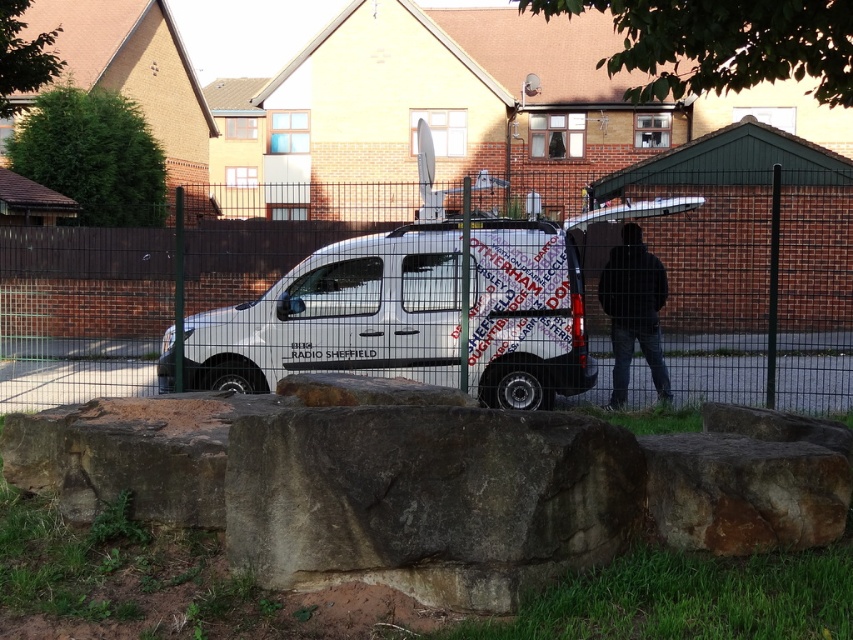
You are standing in the scene and see the brown rough stone at center and the black fabric jacket at center. Which object is closer to the ground?

The brown rough stone at center is closer to the ground because it is below the black fabric jacket at center.

You are standing in front of the white van and looking at the brown rough stone at center and the black fabric jacket at center. Which object is nearer to you?

The brown rough stone at center is closer to the viewer than the black fabric jacket at center.

You are a delivery person trying to deliver a package to the address behind the metal wire mesh fence at center and the black fabric jacket at center. Which object is closer to the delivery point?

The metal wire mesh fence at center is closer to the delivery point because it is positioned to the left of the black fabric jacket at center, meaning it is nearer to the delivery location.